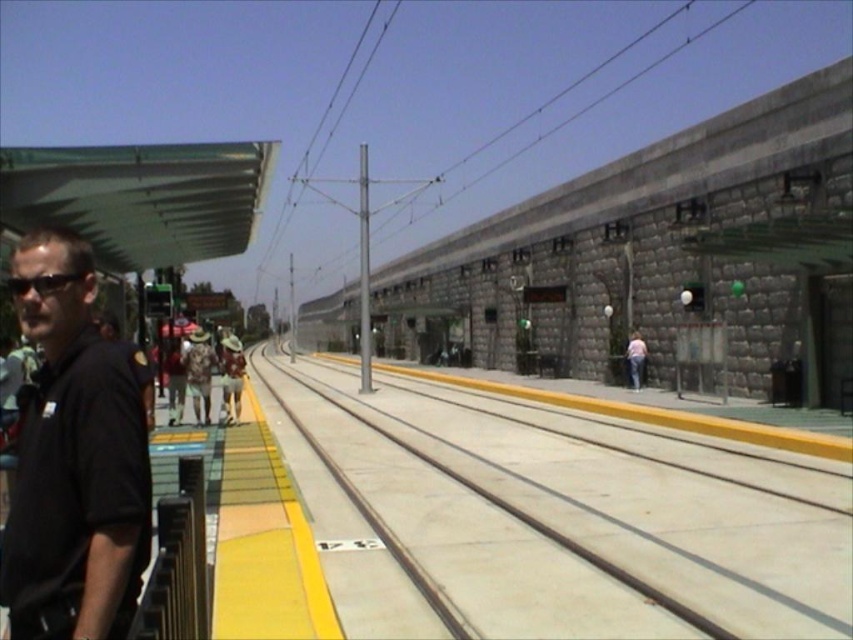
Is concrete at center thinner than camouflage fabric shirt at center?

No, concrete at center is not thinner than camouflage fabric shirt at center.

Between point (808, 470) and point (227, 376), which one is positioned behind?

Positioned behind is point (227, 376).

Identify the location of concrete at center. This screenshot has width=853, height=640. (579, 515).

Consider the image. Does gray stone train at center appear on the right side of yellow rubber platform at left?

No, gray stone train at center is not to the right of yellow rubber platform at left.

Is gray stone train at center closer to the viewer compared to yellow rubber platform at left?

That is False.

Locate an element on the screen. gray stone train at center is located at coordinates (659, 260).

Between yellow rubber platform at left and camouflage fabric shirt at center, which one has less height?

yellow rubber platform at left

Which is behind, point (317, 577) or point (235, 349)?

Positioned behind is point (235, 349).

Locate an element on the screen. Image resolution: width=853 pixels, height=640 pixels. yellow rubber platform at left is located at coordinates pos(264,547).